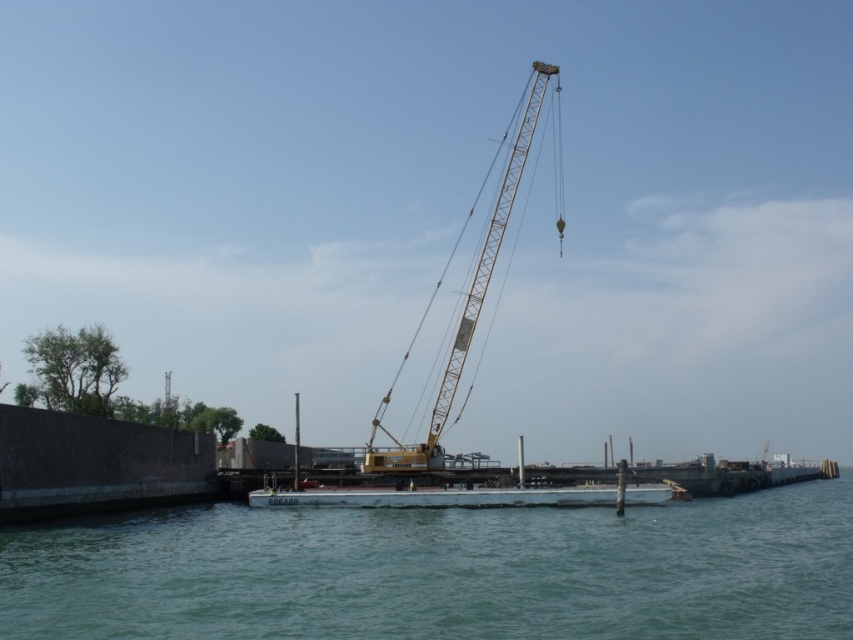
You are standing at the point marked by the coordinates (442, 572) in the image. What object would you be standing on?

The greenish blue water at center is located at point (442, 572), so you would be standing on the greenish blue water at center.